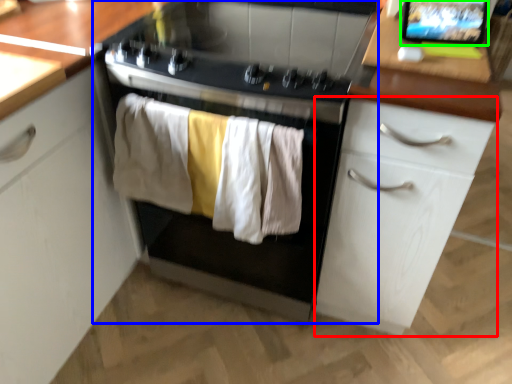
Question: Estimate the real-world distances between objects in this image. Which object is closer to cabinetry (highlighted by a red box), home appliance (highlighted by a blue box) or computer screen (highlighted by a green box)?

Choices:
 (A) home appliance
 (B) computer screen

Answer: (A)